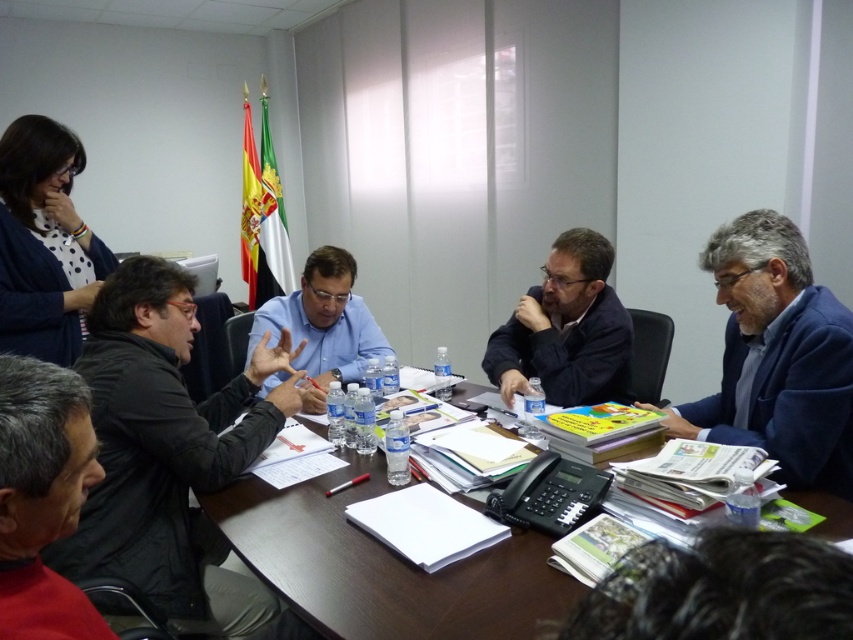
Question: Which object is the closest to the blue fabric suit at right?

Choices:
 (A) blue shirt at center
 (B) dark blue jacket at center

Answer: (B)

Question: Based on their relative distances, which object is farther from the blue shirt at center?

Choices:
 (A) dark blue jacket at center
 (B) red knitwear at lower left
 (C) black matte jacket at center
 (D) blue fabric suit at right

Answer: (B)

Question: From the image, what is the correct spatial relationship of red knitwear at lower left in relation to blue shirt at center?

Choices:
 (A) right
 (B) left

Answer: (B)

Question: Does blue fabric suit at right have a smaller size compared to red knitwear at lower left?

Choices:
 (A) yes
 (B) no

Answer: (B)

Question: Does red knitwear at lower left appear over dark blue jacket at center?

Choices:
 (A) no
 (B) yes

Answer: (A)

Question: Which point is farther to the camera?

Choices:
 (A) blue fabric suit at right
 (B) dark blue jacket at center

Answer: (B)